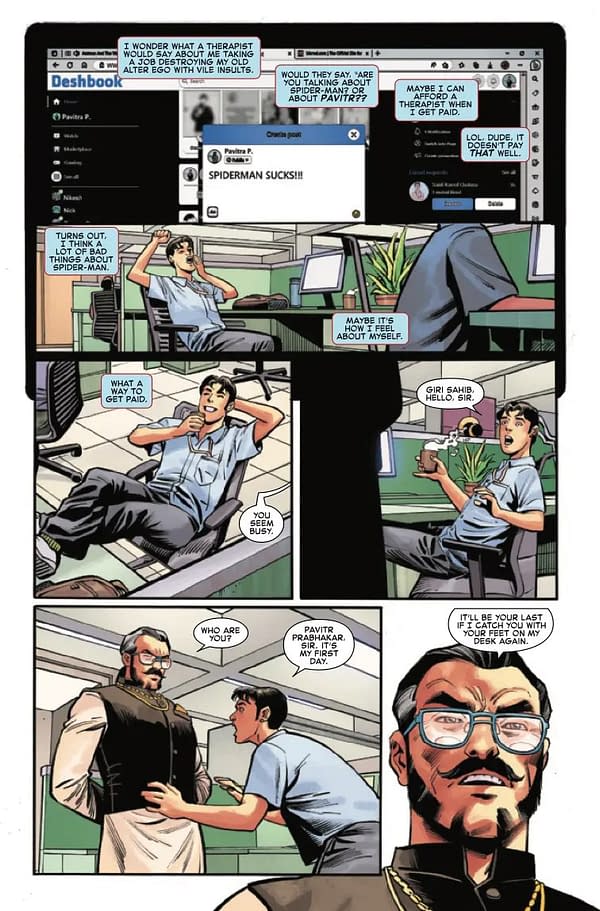
Locate an element on the screen. The height and width of the screenshot is (911, 600). green wall is located at coordinates (223, 834).